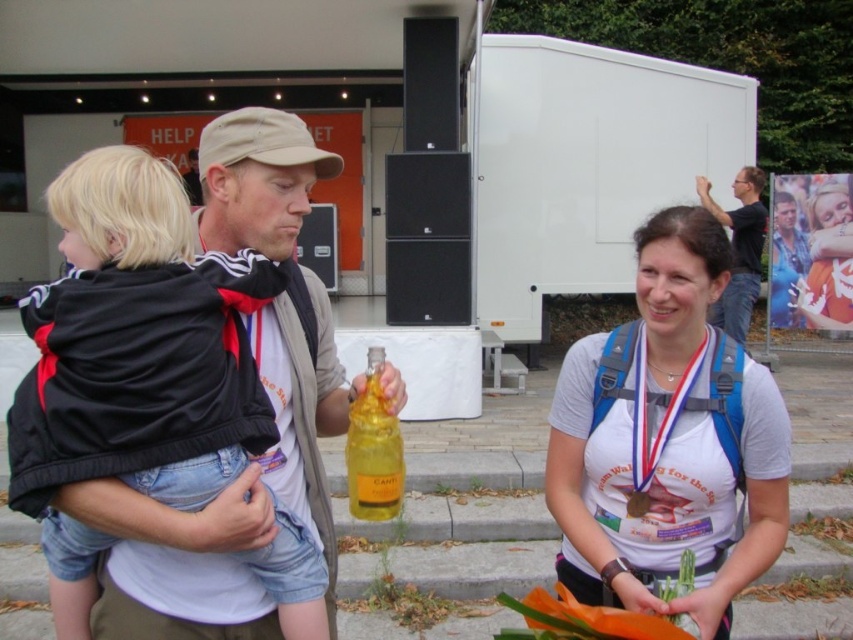
Can you confirm if black fleece jacket at left is bigger than matte black t-shirt at upper right?

No, black fleece jacket at left is not bigger than matte black t-shirt at upper right.

Looking at this image, is black fleece jacket at left to the right of matte black t-shirt at upper right from the viewer's perspective?

In fact, black fleece jacket at left is to the left of matte black t-shirt at upper right.

Locate an element on the screen. This screenshot has width=853, height=640. black fleece jacket at left is located at coordinates (132, 362).

What do you see at coordinates (373, 449) in the screenshot? I see `translucent yellow glass bottle at center` at bounding box center [373, 449].

Is translucent yellow glass bottle at center positioned in front of matte black t-shirt at upper right?

That is True.

The width and height of the screenshot is (853, 640). Identify the location of translucent yellow glass bottle at center. (373, 449).

Is translucent yellow glass bottle at center closer to the viewer compared to matte white t-shirt at center?

Yes.

Between translucent yellow glass bottle at center and matte white t-shirt at center, which one has more height?

With more height is matte white t-shirt at center.

Between point (347, 429) and point (819, 188), which one is positioned in front?

Point (347, 429) is in front.

Where is `translucent yellow glass bottle at center`? This screenshot has width=853, height=640. translucent yellow glass bottle at center is located at coordinates tap(373, 449).